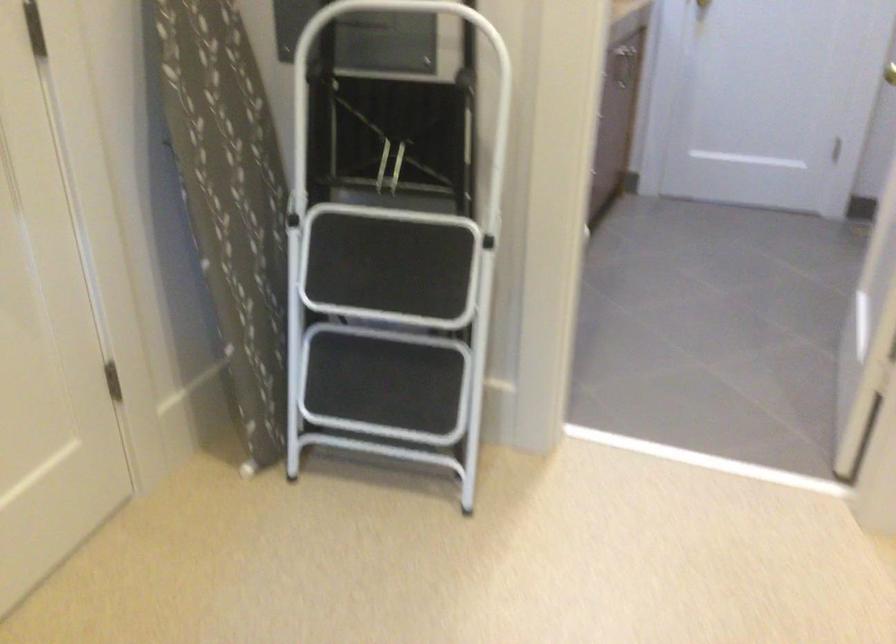
Where is `gold door handle`? This screenshot has width=896, height=644. gold door handle is located at coordinates (890, 73).